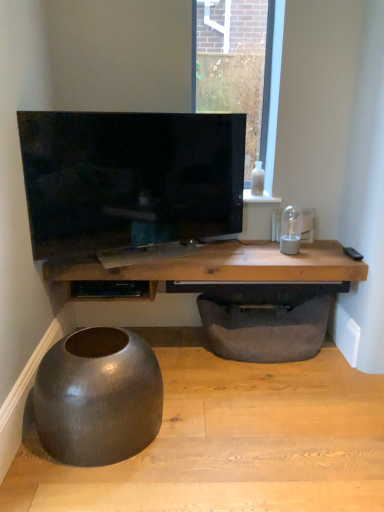
Where is `empty space that is to the right of matte black bowl at lower left`? The image size is (384, 512). empty space that is to the right of matte black bowl at lower left is located at coordinates (214, 423).